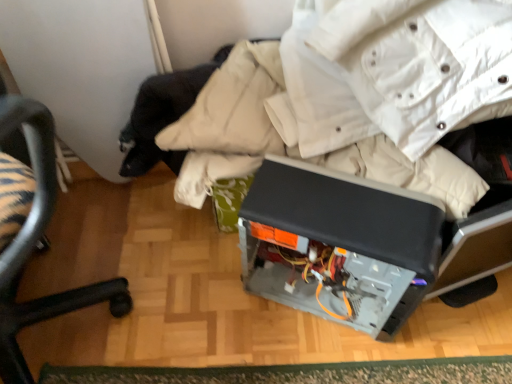
Question: Considering the relative sizes of green textured mat at lower center and black plastic chair at lower left in the image provided, is green textured mat at lower center bigger than black plastic chair at lower left?

Choices:
 (A) yes
 (B) no

Answer: (B)

Question: Can you confirm if green textured mat at lower center is smaller than black plastic chair at lower left?

Choices:
 (A) no
 (B) yes

Answer: (B)

Question: Considering the relative positions of green textured mat at lower center and black plastic chair at lower left in the image provided, is green textured mat at lower center to the left of black plastic chair at lower left from the viewer's perspective?

Choices:
 (A) yes
 (B) no

Answer: (B)

Question: Can you confirm if green textured mat at lower center is taller than black plastic chair at lower left?

Choices:
 (A) yes
 (B) no

Answer: (B)

Question: Considering the relative sizes of green textured mat at lower center and black plastic chair at lower left in the image provided, is green textured mat at lower center thinner than black plastic chair at lower left?

Choices:
 (A) no
 (B) yes

Answer: (B)

Question: Considering their positions, is satin black computer case at center located in front of or behind black plastic chair at lower left?

Choices:
 (A) behind
 (B) front

Answer: (A)

Question: Considering the positions of point (308, 241) and point (23, 241), is point (308, 241) closer or farther from the camera than point (23, 241)?

Choices:
 (A) farther
 (B) closer

Answer: (A)

Question: In the image, is satin black computer case at center on the left side or the right side of black plastic chair at lower left?

Choices:
 (A) left
 (B) right

Answer: (B)

Question: From a real-world perspective, relative to black plastic chair at lower left, is satin black computer case at center vertically above or below?

Choices:
 (A) below
 (B) above

Answer: (A)

Question: From the image's perspective, is black plastic chair at lower left above or below satin black computer case at center?

Choices:
 (A) below
 (B) above

Answer: (B)

Question: Would you say black plastic chair at lower left is to the left or to the right of satin black computer case at center in the picture?

Choices:
 (A) right
 (B) left

Answer: (B)

Question: From their relative heights in the image, would you say black plastic chair at lower left is taller or shorter than satin black computer case at center?

Choices:
 (A) short
 (B) tall

Answer: (B)

Question: In terms of width, does black plastic chair at lower left look wider or thinner when compared to satin black computer case at center?

Choices:
 (A) thin
 (B) wide

Answer: (B)

Question: From the image's perspective, relative to green textured mat at lower center, is black plastic chair at lower left above or below?

Choices:
 (A) above
 (B) below

Answer: (A)

Question: In terms of width, does black plastic chair at lower left look wider or thinner when compared to green textured mat at lower center?

Choices:
 (A) thin
 (B) wide

Answer: (B)